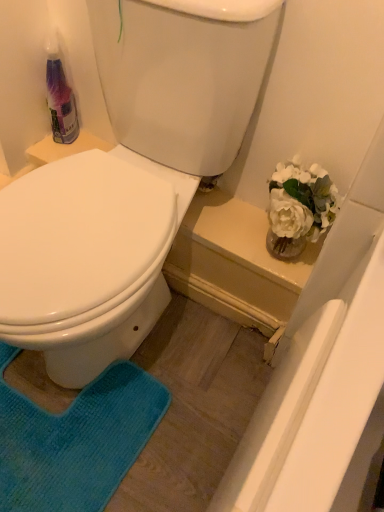
The height and width of the screenshot is (512, 384). In order to click on blue textured rug at lower left in this screenshot , I will do `click(75, 440)`.

The image size is (384, 512). Identify the location of yoga mat that is on the left side of white glossy toilet at center. (75, 440).

Is blue textured rug at lower left wider than white glossy toilet at center?

No.

Based on their positions, is blue textured rug at lower left located to the left or right of white glossy toilet at center?

Clearly, blue textured rug at lower left is on the left of white glossy toilet at center in the image.

Is blue textured rug at lower left positioned with its back to white glossy toilet at center?

Correct, blue textured rug at lower left is looking away from white glossy toilet at center.

Which object is thinner, translucent plastic bottle at upper left or blue textured rug at lower left?

Thinner between the two is translucent plastic bottle at upper left.

Which is more to the right, translucent plastic bottle at upper left or blue textured rug at lower left?

blue textured rug at lower left is more to the right.

Based on the photo, from a real-world perspective, is translucent plastic bottle at upper left under blue textured rug at lower left?

No, from a real-world perspective, translucent plastic bottle at upper left is not under blue textured rug at lower left.

Is white glossy toilet at center oriented away from blue textured rug at lower left?

No, white glossy toilet at center is not facing away from blue textured rug at lower left.

From a real-world perspective, which is physically above, white glossy toilet at center or blue textured rug at lower left?

white glossy toilet at center, from a real-world perspective.

Is white glossy toilet at center located outside blue textured rug at lower left?

white glossy toilet at center is positioned outside blue textured rug at lower left.

What's the angular difference between white glossy toilet at center and blue textured rug at lower left's facing directions?

The facing directions of white glossy toilet at center and blue textured rug at lower left are 1.18 degrees apart.

Where is `yoga mat located below the translucent plastic bottle at upper left (from the image's perspective)`? yoga mat located below the translucent plastic bottle at upper left (from the image's perspective) is located at coordinates (75, 440).

Which is behind, point (26, 461) or point (70, 136)?

Positioned behind is point (70, 136).

How different are the orientations of blue textured rug at lower left and translucent plastic bottle at upper left in degrees?

0.784 degrees.

Considering the positions of objects white glossy toilet at center and translucent plastic bottle at upper left in the image provided, who is more to the left, white glossy toilet at center or translucent plastic bottle at upper left?

Positioned to the left is translucent plastic bottle at upper left.

Is white glossy toilet at center completely or partially outside of translucent plastic bottle at upper left?

Indeed, white glossy toilet at center is completely outside translucent plastic bottle at upper left.

Considering the points (65, 326) and (69, 124), which point is in front, point (65, 326) or point (69, 124)?

Positioned in front is point (65, 326).

Which of these two, translucent plastic bottle at upper left or white glossy toilet at center, stands taller?

Standing taller between the two is white glossy toilet at center.

Locate an element on the screen. cleaning product on the left of white glossy toilet at center is located at coordinates (60, 96).

Considering the relative sizes of translucent plastic bottle at upper left and white glossy toilet at center in the image provided, is translucent plastic bottle at upper left thinner than white glossy toilet at center?

Indeed, translucent plastic bottle at upper left has a lesser width compared to white glossy toilet at center.

Which object is positioned more to the left, translucent plastic bottle at upper left or white glossy toilet at center?

translucent plastic bottle at upper left.

Image resolution: width=384 pixels, height=512 pixels. I want to click on yoga mat that is below the white glossy toilet at center (from the image's perspective), so click(x=75, y=440).

Identify the location of yoga mat below the translucent plastic bottle at upper left (from a real-world perspective). (75, 440).

Estimate the real-world distances between objects in this image. Which object is further from blue textured rug at lower left, translucent plastic bottle at upper left or white glossy toilet at center?

translucent plastic bottle at upper left is positioned further to the anchor blue textured rug at lower left.

When comparing their distances from white glossy toilet at center, does blue textured rug at lower left or translucent plastic bottle at upper left seem further?

blue textured rug at lower left is further to white glossy toilet at center.

Estimate the real-world distances between objects in this image. Which object is closer to blue textured rug at lower left, white glossy toilet at center or translucent plastic bottle at upper left?

white glossy toilet at center is positioned closer to the anchor blue textured rug at lower left.

Based on their spatial positions, is translucent plastic bottle at upper left or blue textured rug at lower left closer to white glossy toilet at center?

translucent plastic bottle at upper left.

When comparing their distances from translucent plastic bottle at upper left, does white glossy toilet at center or blue textured rug at lower left seem closer?

white glossy toilet at center is positioned closer to the anchor translucent plastic bottle at upper left.

Based on their spatial positions, is blue textured rug at lower left or white glossy toilet at center further from translucent plastic bottle at upper left?

blue textured rug at lower left lies further to translucent plastic bottle at upper left than the other object.

The image size is (384, 512). Find the location of `toilet between translucent plastic bottle at upper left and blue textured rug at lower left from top to bottom`. toilet between translucent plastic bottle at upper left and blue textured rug at lower left from top to bottom is located at coordinates (130, 183).